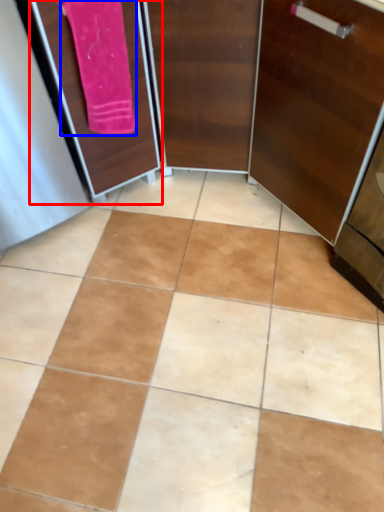
Question: Which point is closer to the camera, screen door (highlighted by a red box) or bath towel (highlighted by a blue box)?

Choices:
 (A) screen door
 (B) bath towel

Answer: (A)